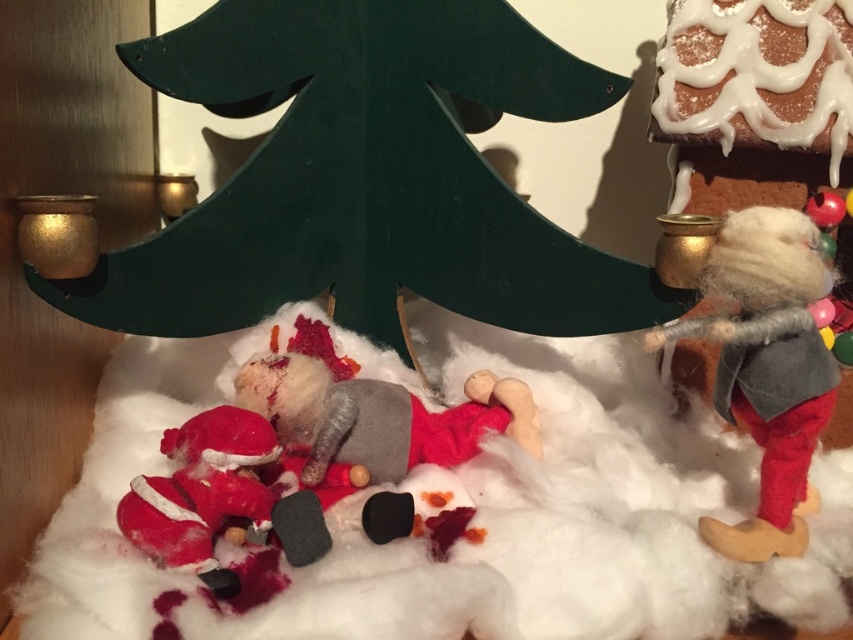
Is fuzzy woolen elf at right positioned at the back of fuzzy red santa at lower left?

Yes, fuzzy woolen elf at right is behind fuzzy red santa at lower left.

Which is more to the right, fuzzy woolen elf at right or fuzzy red santa at lower left?

fuzzy woolen elf at right

You are a GUI agent. You are given a task and a screenshot of the screen. Output one action in this format:
    pyautogui.click(x=<x>, y=<y>)
    Task: Click on the fuzzy woolen elf at right
    The width and height of the screenshot is (853, 640).
    Given the screenshot: What is the action you would take?
    pyautogui.click(x=767, y=369)

Where is `fuzzy woolen elf at right`? This screenshot has height=640, width=853. fuzzy woolen elf at right is located at coordinates (767, 369).